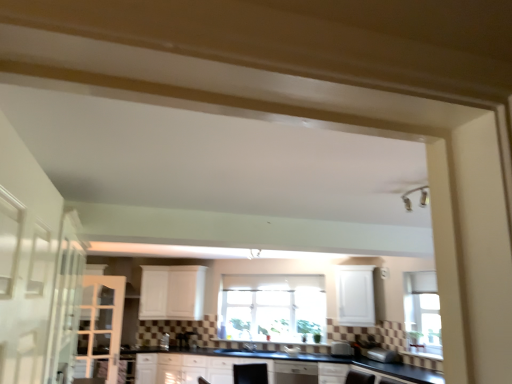
Question: Is white matte cabinet at center, the first cabinetry in the back-to-front sequence, completely or partially outside of white matte cabinet at center, acting as the 2th cabinetry starting from the left?

Choices:
 (A) yes
 (B) no

Answer: (A)

Question: Is white matte cabinet at center, which is the 2th cabinetry in right-to-left order, next to white matte cabinet at center, which appears as the 1th cabinetry when viewed from the front?

Choices:
 (A) yes
 (B) no

Answer: (B)

Question: Does white matte cabinet at center, the first cabinetry in the back-to-front sequence, appear on the right side of white matte cabinet at center, which appears as the 1th cabinetry when viewed from the front?

Choices:
 (A) yes
 (B) no

Answer: (B)

Question: Does white matte cabinet at center, arranged as the 2th cabinetry when viewed from the front, have a lesser height compared to white matte cabinet at center, acting as the 2th cabinetry starting from the left?

Choices:
 (A) no
 (B) yes

Answer: (A)

Question: Does white matte cabinet at center, arranged as the 2th cabinetry when viewed from the front, come behind white matte cabinet at center, which appears as the 1th cabinetry when viewed from the front?

Choices:
 (A) no
 (B) yes

Answer: (B)

Question: Is white matte cabinet at center, which is the 2th cabinetry in right-to-left order, at the left side of white matte cabinet at center, acting as the 2th cabinetry starting from the left?

Choices:
 (A) no
 (B) yes

Answer: (B)

Question: Does black glossy sink at center have a smaller size compared to white matte cabinet at center, which is the 2th cabinetry in right-to-left order?

Choices:
 (A) no
 (B) yes

Answer: (B)

Question: Is black glossy sink at center further to camera compared to white matte cabinet at center, which is the 2th cabinetry in right-to-left order?

Choices:
 (A) yes
 (B) no

Answer: (B)

Question: Does black glossy sink at center appear on the left side of white matte cabinet at center, the first cabinetry in the back-to-front sequence?

Choices:
 (A) yes
 (B) no

Answer: (B)

Question: From the image's perspective, does black glossy sink at center appear lower than white matte cabinet at center, the first cabinetry in the back-to-front sequence?

Choices:
 (A) no
 (B) yes

Answer: (B)

Question: Is black glossy sink at center in contact with white matte cabinet at center, arranged as the 2th cabinetry when viewed from the front?

Choices:
 (A) yes
 (B) no

Answer: (B)

Question: From a real-world perspective, is black glossy sink at center under white matte cabinet at center, the first cabinetry in the back-to-front sequence?

Choices:
 (A) no
 (B) yes

Answer: (B)

Question: Can you confirm if clear glass window at center is positioned to the left of satin silver toaster at lower center, which is counted as the second appliance, starting from the left?

Choices:
 (A) yes
 (B) no

Answer: (A)